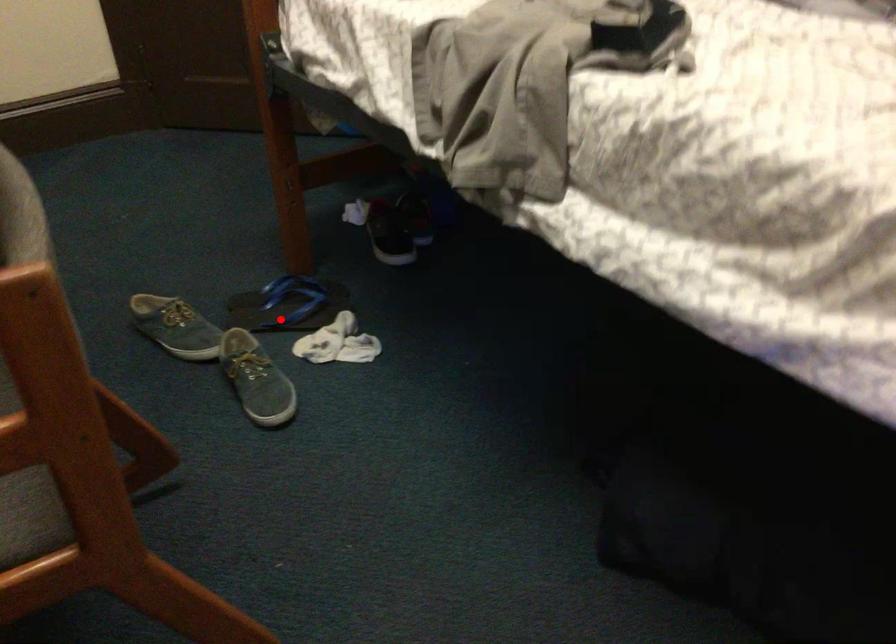
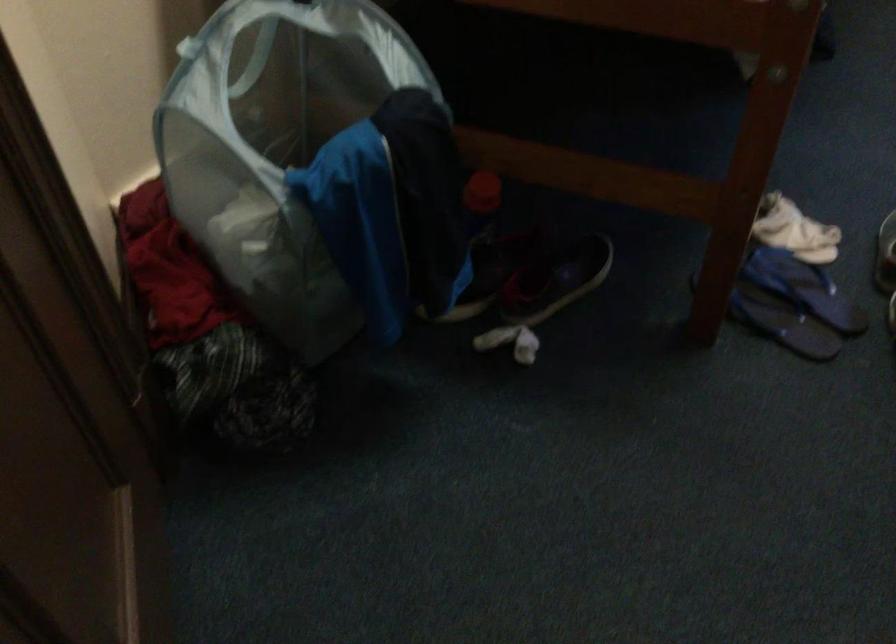
Question: I am providing you with two images of the same scene from different viewpoints. Image1 has a red point marked. In image2, the corresponding 3D location appears at what relative position? Reply with the corresponding letter.

Choices:
 (A) Closer
 (B) Farther

Answer: (A)